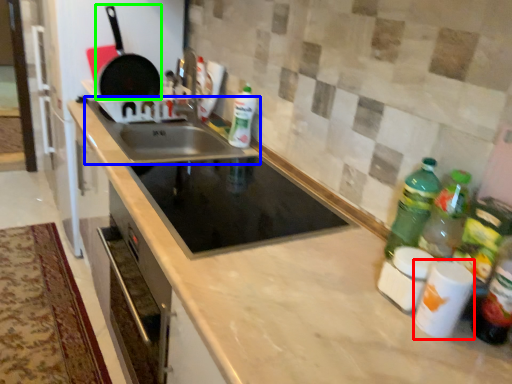
Question: Which is farther away from appliance (highlighted by a red box)? sink (highlighted by a blue box) or frying pan (highlighted by a green box)?

Choices:
 (A) sink
 (B) frying pan

Answer: (B)